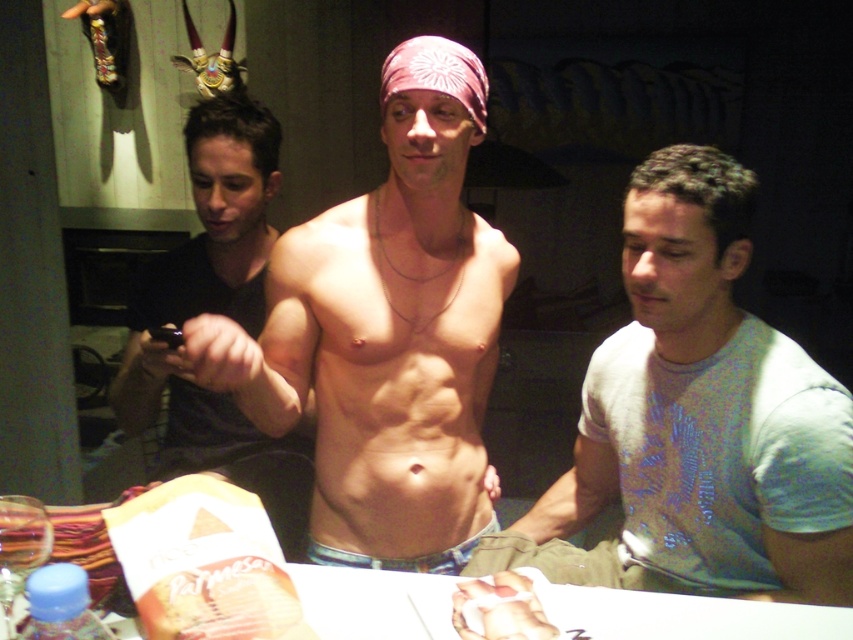
Question: Can you confirm if light blue cotton shirt at center is bigger than smooth skin torso at center?

Choices:
 (A) no
 (B) yes

Answer: (A)

Question: Which point appears farthest from the camera in this image?

Choices:
 (A) (349, 589)
 (B) (630, 413)
 (C) (503, 275)

Answer: (C)

Question: Among these points, which one is farthest from the camera?

Choices:
 (A) (560, 593)
 (B) (247, 138)
 (C) (482, 474)

Answer: (B)

Question: Is smooth skin torso at center closer to the viewer compared to white glossy table at center?

Choices:
 (A) no
 (B) yes

Answer: (A)

Question: Is pink fabric headband at center behind white glossy table at center?

Choices:
 (A) yes
 (B) no

Answer: (A)

Question: Which point appears farthest from the camera in this image?

Choices:
 (A) (129, 420)
 (B) (403, 237)
 (C) (677, 618)
 (D) (650, 323)

Answer: (A)